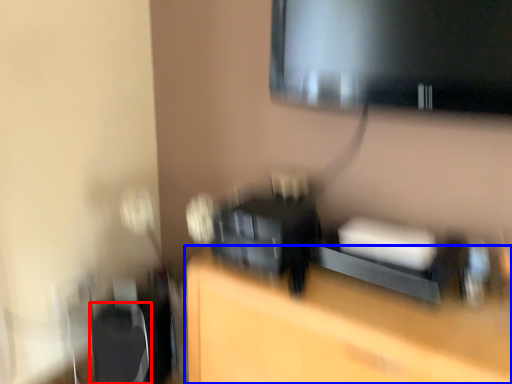
Question: Which object is closer to the camera taking this photo, swivel chair (highlighted by a red box) or furniture (highlighted by a blue box)?

Choices:
 (A) swivel chair
 (B) furniture

Answer: (B)